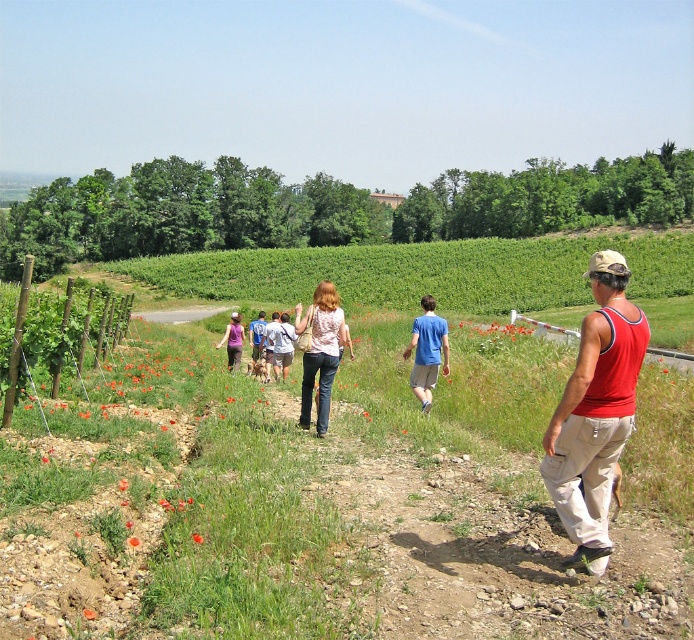
Question: Which of these objects is positioned closest to the matte pink shirt at center?

Choices:
 (A) denim shorts at center
 (B) blue cotton shirt at center

Answer: (B)

Question: Is matte pink shirt at center closer to camera compared to blue cotton shirt at center?

Choices:
 (A) yes
 (B) no

Answer: (A)

Question: Does matte pink shirt at center appear over denim shorts at center?

Choices:
 (A) no
 (B) yes

Answer: (A)

Question: Which object is positioned closest to the matte pink shirt at center?

Choices:
 (A) red sleeveless tank top at right
 (B) blue cotton shirt at center

Answer: (B)

Question: Can you confirm if matte pink shirt at center is wider than denim shorts at center?

Choices:
 (A) no
 (B) yes

Answer: (A)

Question: Which of these objects is positioned closest to the denim shorts at center?

Choices:
 (A) blue cotton shirt at center
 (B) matte pink shirt at center

Answer: (A)